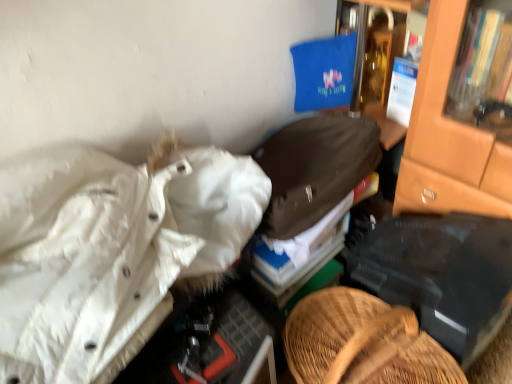
Describe the element at coordinates (314, 169) in the screenshot. Image resolution: width=512 pixels, height=384 pixels. I see `brown fabric jacket at center, the 1th clothing when ordered from top to bottom` at that location.

Identify the location of brown fabric jacket at center, placed as the second clothing when sorted from bottom to top. This screenshot has width=512, height=384. (314, 169).

The height and width of the screenshot is (384, 512). In order to click on white puffy jacket at left, acting as the 1th clothing starting from the bottom in this screenshot , I will do `click(110, 252)`.

What do you see at coordinates (110, 252) in the screenshot?
I see `white puffy jacket at left, placed as the 2th clothing when sorted from top to bottom` at bounding box center [110, 252].

This screenshot has width=512, height=384. What are the coordinates of `brown fabric jacket at center, the 1th clothing when ordered from top to bottom` in the screenshot? It's located at (314, 169).

Between white puffy jacket at left, acting as the 1th clothing starting from the bottom, and brown fabric jacket at center, placed as the second clothing when sorted from bottom to top, which one appears on the right side from the viewer's perspective?

brown fabric jacket at center, placed as the second clothing when sorted from bottom to top.

Looking at this image, does white puffy jacket at left, placed as the 2th clothing when sorted from top to bottom, come in front of brown fabric jacket at center, placed as the second clothing when sorted from bottom to top?

Yes, white puffy jacket at left, placed as the 2th clothing when sorted from top to bottom, is in front of brown fabric jacket at center, placed as the second clothing when sorted from bottom to top.

Which is in front, point (163, 182) or point (270, 215)?

Positioned in front is point (163, 182).

From the image's perspective, which one is positioned lower, white puffy jacket at left, acting as the 1th clothing starting from the bottom, or brown fabric jacket at center, placed as the second clothing when sorted from bottom to top?

From the image's view, white puffy jacket at left, acting as the 1th clothing starting from the bottom, is below.

From a real-world perspective, is white puffy jacket at left, placed as the 2th clothing when sorted from top to bottom, under brown fabric jacket at center, placed as the second clothing when sorted from bottom to top?

No, from a real-world perspective, white puffy jacket at left, placed as the 2th clothing when sorted from top to bottom, is not under brown fabric jacket at center, placed as the second clothing when sorted from bottom to top.

Considering the sizes of objects white puffy jacket at left, acting as the 1th clothing starting from the bottom, and brown fabric jacket at center, the 1th clothing when ordered from top to bottom, in the image provided, who is wider, white puffy jacket at left, acting as the 1th clothing starting from the bottom, or brown fabric jacket at center, the 1th clothing when ordered from top to bottom,?

white puffy jacket at left, acting as the 1th clothing starting from the bottom.

Which of these two, white puffy jacket at left, acting as the 1th clothing starting from the bottom, or brown fabric jacket at center, the 1th clothing when ordered from top to bottom, stands shorter?

Standing shorter between the two is brown fabric jacket at center, the 1th clothing when ordered from top to bottom.

Who is bigger, white puffy jacket at left, acting as the 1th clothing starting from the bottom, or brown fabric jacket at center, placed as the second clothing when sorted from bottom to top?

With larger size is white puffy jacket at left, acting as the 1th clothing starting from the bottom.

Can brown fabric jacket at center, placed as the second clothing when sorted from bottom to top, be found inside white puffy jacket at left, acting as the 1th clothing starting from the bottom?

No, brown fabric jacket at center, placed as the second clothing when sorted from bottom to top, is not inside white puffy jacket at left, acting as the 1th clothing starting from the bottom.

Is white puffy jacket at left, acting as the 1th clothing starting from the bottom, beside brown fabric jacket at center, placed as the second clothing when sorted from bottom to top?

white puffy jacket at left, acting as the 1th clothing starting from the bottom, and brown fabric jacket at center, placed as the second clothing when sorted from bottom to top, are not in contact.

Is white puffy jacket at left, placed as the 2th clothing when sorted from top to bottom, facing towards brown fabric jacket at center, placed as the second clothing when sorted from bottom to top?

No, white puffy jacket at left, placed as the 2th clothing when sorted from top to bottom, is not facing towards brown fabric jacket at center, placed as the second clothing when sorted from bottom to top.

How different are the orientations of white puffy jacket at left, placed as the 2th clothing when sorted from top to bottom, and brown fabric jacket at center, the 1th clothing when ordered from top to bottom, in degrees?

There is a 7.38-degree angle between the facing directions of white puffy jacket at left, placed as the 2th clothing when sorted from top to bottom, and brown fabric jacket at center, the 1th clothing when ordered from top to bottom.

Find the location of a particular element. The image size is (512, 384). clothing behind the white puffy jacket at left, acting as the 1th clothing starting from the bottom is located at coordinates (314, 169).

Between brown fabric jacket at center, the 1th clothing when ordered from top to bottom, and white puffy jacket at left, acting as the 1th clothing starting from the bottom, which one appears on the left side from the viewer's perspective?

white puffy jacket at left, acting as the 1th clothing starting from the bottom, is more to the left.

Considering the positions of objects brown fabric jacket at center, placed as the second clothing when sorted from bottom to top, and white puffy jacket at left, placed as the 2th clothing when sorted from top to bottom, in the image provided, who is behind, brown fabric jacket at center, placed as the second clothing when sorted from bottom to top, or white puffy jacket at left, placed as the 2th clothing when sorted from top to bottom,?

brown fabric jacket at center, placed as the second clothing when sorted from bottom to top.

Between point (279, 146) and point (136, 183), which one is positioned in front?

The point (136, 183) is in front.

From the image's perspective, is brown fabric jacket at center, the 1th clothing when ordered from top to bottom, above white puffy jacket at left, acting as the 1th clothing starting from the bottom?

Yes, from the image's perspective, brown fabric jacket at center, the 1th clothing when ordered from top to bottom, is on top of white puffy jacket at left, acting as the 1th clothing starting from the bottom.

From a real-world perspective, is brown fabric jacket at center, placed as the second clothing when sorted from bottom to top, under white puffy jacket at left, placed as the 2th clothing when sorted from top to bottom?

Yes, from a real-world perspective, brown fabric jacket at center, placed as the second clothing when sorted from bottom to top, is beneath white puffy jacket at left, placed as the 2th clothing when sorted from top to bottom.

Can you confirm if brown fabric jacket at center, the 1th clothing when ordered from top to bottom, is wider than white puffy jacket at left, acting as the 1th clothing starting from the bottom?

No, brown fabric jacket at center, the 1th clothing when ordered from top to bottom, is not wider than white puffy jacket at left, acting as the 1th clothing starting from the bottom.

From the picture: Who is taller, brown fabric jacket at center, the 1th clothing when ordered from top to bottom, or white puffy jacket at left, acting as the 1th clothing starting from the bottom?

With more height is white puffy jacket at left, acting as the 1th clothing starting from the bottom.

Looking at the image, does brown fabric jacket at center, the 1th clothing when ordered from top to bottom, seem bigger or smaller compared to white puffy jacket at left, acting as the 1th clothing starting from the bottom?

In the image, brown fabric jacket at center, the 1th clothing when ordered from top to bottom, appears to be smaller than white puffy jacket at left, acting as the 1th clothing starting from the bottom.

From the picture: Do you think brown fabric jacket at center, the 1th clothing when ordered from top to bottom, is within white puffy jacket at left, acting as the 1th clothing starting from the bottom, or outside of it?

brown fabric jacket at center, the 1th clothing when ordered from top to bottom, is not enclosed by white puffy jacket at left, acting as the 1th clothing starting from the bottom.

Is the surface of brown fabric jacket at center, placed as the second clothing when sorted from bottom to top, in direct contact with white puffy jacket at left, acting as the 1th clothing starting from the bottom?

They are not placed beside each other.

Does brown fabric jacket at center, placed as the second clothing when sorted from bottom to top, turn towards white puffy jacket at left, placed as the 2th clothing when sorted from top to bottom?

No, brown fabric jacket at center, placed as the second clothing when sorted from bottom to top, is not oriented towards white puffy jacket at left, placed as the 2th clothing when sorted from top to bottom.

How many degrees apart are the facing directions of brown fabric jacket at center, placed as the second clothing when sorted from bottom to top, and white puffy jacket at left, acting as the 1th clothing starting from the bottom?

They differ by 7.38 degrees in their facing directions.

At what (x,y) coordinates should I click in order to perform the action: click on clothing that is above the white puffy jacket at left, placed as the 2th clothing when sorted from top to bottom (from the image's perspective). Please return your answer as a coordinate pair (x, y). Image resolution: width=512 pixels, height=384 pixels. Looking at the image, I should click on (314, 169).

I want to click on clothing below the brown fabric jacket at center, placed as the second clothing when sorted from bottom to top (from the image's perspective), so click(110, 252).

At what (x,y) coordinates should I click in order to perform the action: click on clothing in front of the brown fabric jacket at center, the 1th clothing when ordered from top to bottom. Please return your answer as a coordinate pair (x, y). The height and width of the screenshot is (384, 512). Looking at the image, I should click on (110, 252).